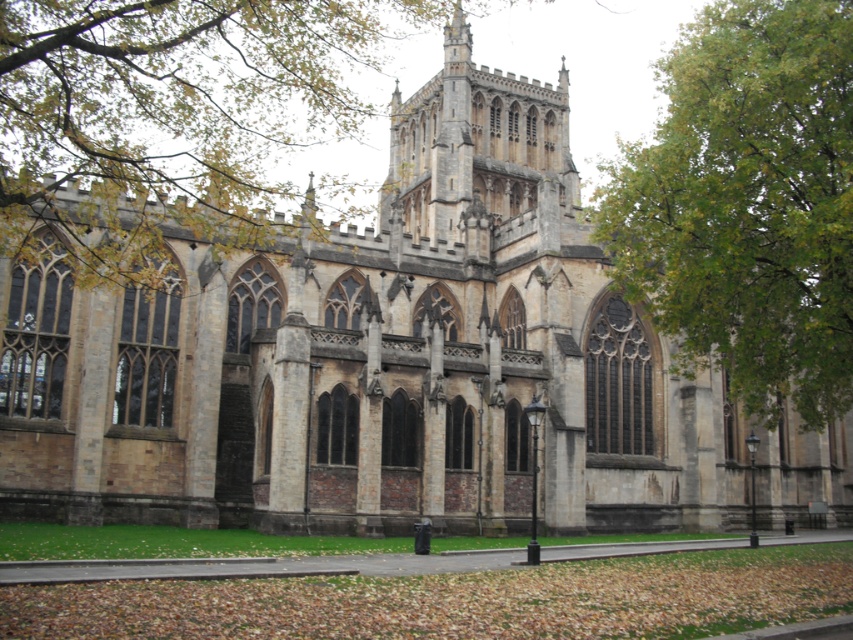
You are an architect examining the cathedral surrounded by green leafy trees. You need to determine which of the two trees, the green leafy tree at upper center or the green leafy tree at upper right, has a wider spread. Based on the scene, which tree should you note as having a greater width?

The green leafy tree at upper center has a greater width compared to the green leafy tree at upper right, as its width surpasses the latter.

You are a drone operator tasked with capturing aerial footage of the cathedral. Your drone has a maximum flight range of 30 meters from its starting position. If you position the drone at the green leafy tree at upper center, will it be able to reach the green leafy tree at upper right without exceeding its range?

The distance between the green leafy tree at upper center and the green leafy tree at upper right is 32.13 meters. Since the drone has a maximum range of 30 meters, it cannot reach the green leafy tree at upper right from the green leafy tree at upper center without exceeding its range.

You are standing in front of the cathedral and notice two points marked on the facade. The first point is at coordinates point [70,148] and the second is at point [729,385]. Which point is closer to the base of the cathedral?

Point [729,385] is closer to the base of the cathedral because it is in front of point [70,148], which is further away from the base.